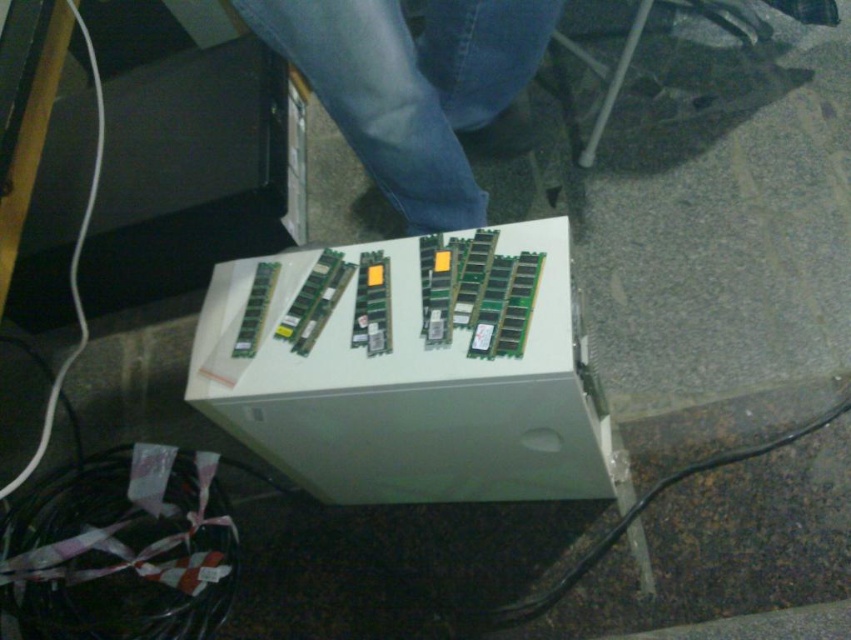
You are a delivery person who just arrived with a small package. You need to place it on the surface near the jeans at center without blocking the view of the white plastic box at center. Can you fit the package between them if it is 30 centimeters long?

The white plastic box at center is 32.57 centimeters from jeans at center. Since the package is 30 centimeters long, it can fit between them as the distance is slightly larger than the package length.

You are organizing items on a desk and see the white plastic box at center and the jeans at center. Which item is positioned lower on the desk?

The white plastic box at center is located below jeans at center, so it is positioned lower on the desk.